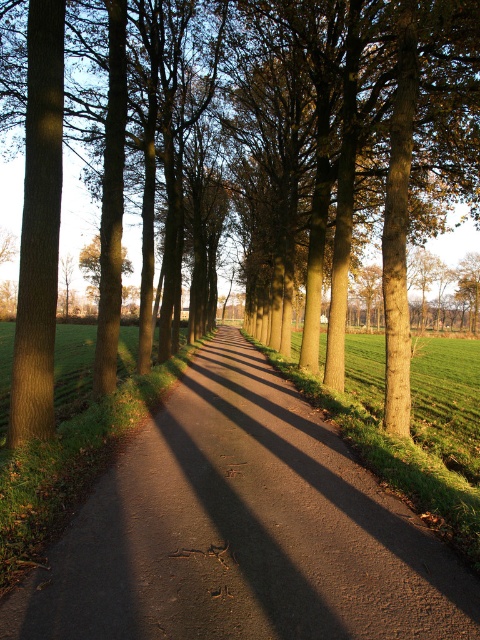
Who is positioned more to the right, brown textured tree at center or dark brown asphalt at center?

dark brown asphalt at center

Does brown textured tree at center appear on the right side of dark brown asphalt at center?

Incorrect, brown textured tree at center is not on the right side of dark brown asphalt at center.

The width and height of the screenshot is (480, 640). In order to click on brown textured tree at center in this screenshot , I will do `click(242, 157)`.

I want to click on brown textured tree at center, so click(242, 157).